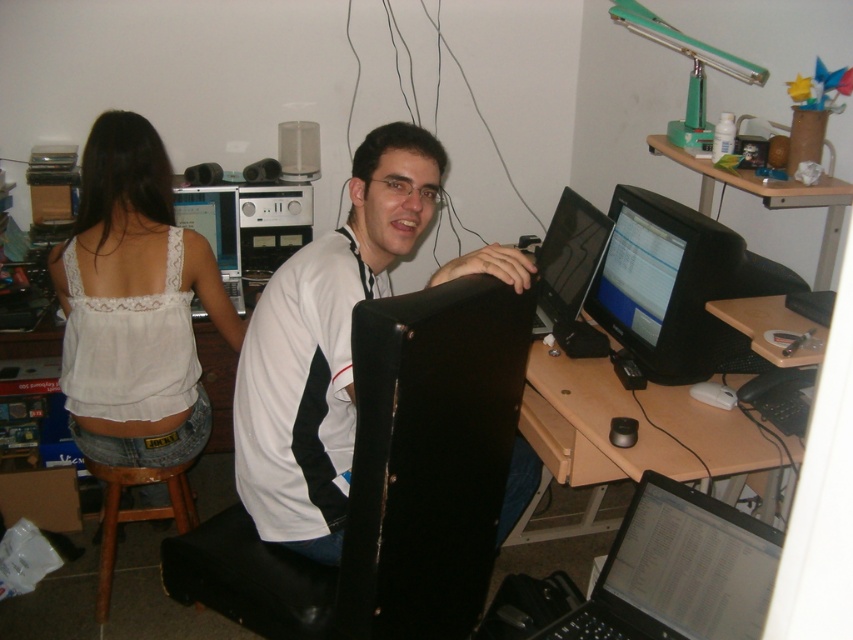
Question: Which is nearer to the white matte shirt at center?

Choices:
 (A) matte black monitor at upper left
 (B) white lace tank top at upper left

Answer: (B)

Question: Is silver metallic laptop at lower right smaller than matte black monitor at upper left?

Choices:
 (A) yes
 (B) no

Answer: (A)

Question: Does wooden at center have a lesser width compared to matte black monitor at center?

Choices:
 (A) yes
 (B) no

Answer: (B)

Question: Estimate the real-world distances between objects in this image. Which object is closer to the black glossy monitor at center?

Choices:
 (A) white lace tank top at upper left
 (B) silver metallic laptop at lower right
 (C) brown wooden stool at lower left
 (D) matte black monitor at center

Answer: (D)

Question: Which of the following is the farthest from the observer?

Choices:
 (A) (479, 403)
 (B) (160, 472)
 (C) (224, 276)

Answer: (C)

Question: Does wooden desk at upper right appear over matte black monitor at upper left?

Choices:
 (A) yes
 (B) no

Answer: (A)